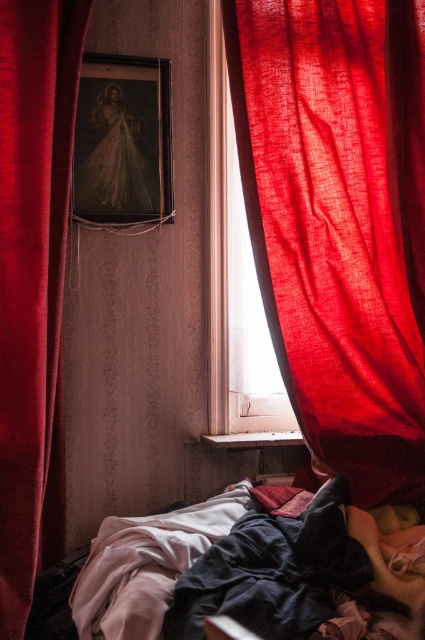
Consider the image. You are standing in the room and want to locate the point at coordinates point [339,221]. According to the scene description, where exactly is this point located?

The point point [339,221] is on the matte red curtain at center.

You are standing in the room depicted in the image. There is a point labeled as point (402, 518). Is this point closer to you or farther away than 6 feet?

The point (402, 518) is 5.89 feet from the viewer, so it is closer than 6 feet.

You are standing in the dimly lit room with the window covered by red curtains. You see a point at coordinates point (x=362, y=54). Can you reach that point with your outstretched hand if you are standing 5 feet away from it?

The point (x=362, y=54) is 6.26 feet away from the camera. Since you are standing 5 feet away from it, you are closer than the camera, so you can reach it with your outstretched hand.